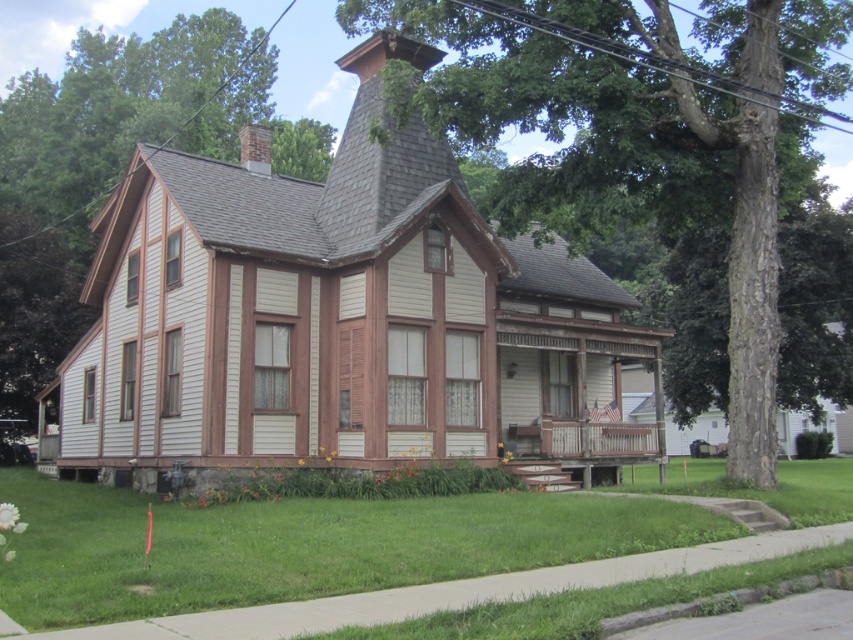
Question: Which object appears closest to the camera in this image?

Choices:
 (A) green leafy tree at left
 (B) smooth brown bark at center

Answer: (B)

Question: Observing the image, what is the correct spatial positioning of smooth brown bark at center in reference to green leafy tree at left?

Choices:
 (A) left
 (B) right

Answer: (B)

Question: Is smooth brown bark at center behind green leafy tree at left?

Choices:
 (A) no
 (B) yes

Answer: (A)

Question: Observing the image, what is the correct spatial positioning of smooth brown bark at center in reference to green leafy tree at left?

Choices:
 (A) below
 (B) above

Answer: (A)